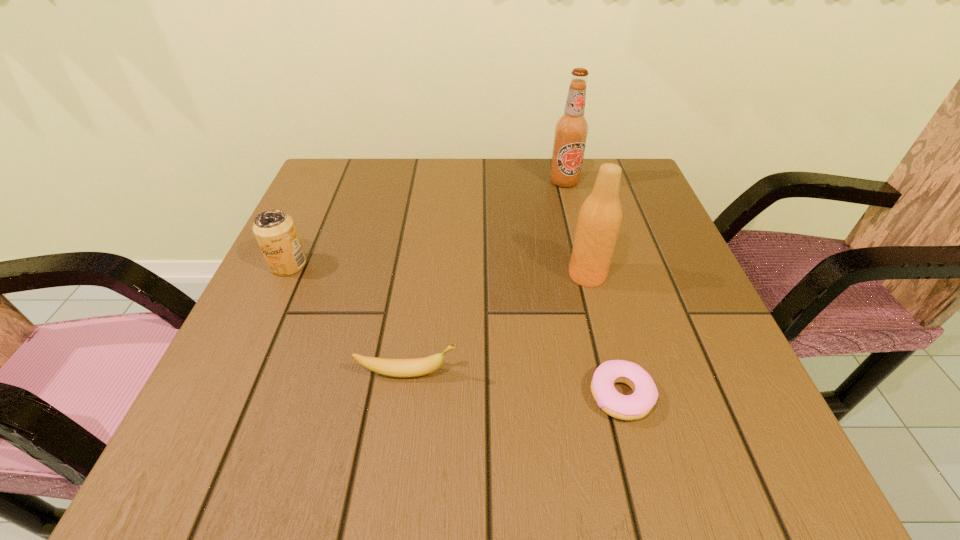
What are the coordinates of `vacant area situated at the stem of the second object from left to right` in the screenshot? It's located at (489, 373).

This screenshot has height=540, width=960. In order to click on vacant region located on the left of the doughnut in this screenshot , I will do `click(513, 395)`.

Where is `object that is at the far edge`? object that is at the far edge is located at coordinates (571, 130).

This screenshot has height=540, width=960. What are the coordinates of `object at the near edge` in the screenshot? It's located at click(x=645, y=394).

This screenshot has width=960, height=540. In order to click on object present at the left edge in this screenshot , I will do `click(275, 231)`.

The width and height of the screenshot is (960, 540). I want to click on object located in the right edge section of the desktop, so click(645, 394).

Image resolution: width=960 pixels, height=540 pixels. What are the coordinates of `object present at the near right corner` in the screenshot? It's located at (645, 394).

The width and height of the screenshot is (960, 540). Find the location of `vacant space at the far edge of the desktop`. vacant space at the far edge of the desktop is located at coordinates (394, 205).

Locate an element on the screen. The height and width of the screenshot is (540, 960). free spot at the near edge of the desktop is located at coordinates (572, 451).

Find the location of `vacant area at the left edge of the desktop`. vacant area at the left edge of the desktop is located at coordinates (309, 261).